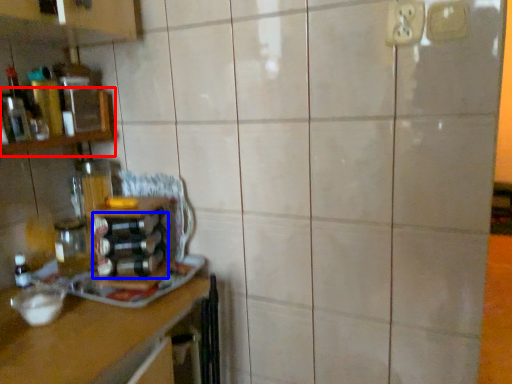
Question: Which point is further to the camera, shelf (highlighted by a red box) or bottle (highlighted by a blue box)?

Choices:
 (A) shelf
 (B) bottle

Answer: (B)